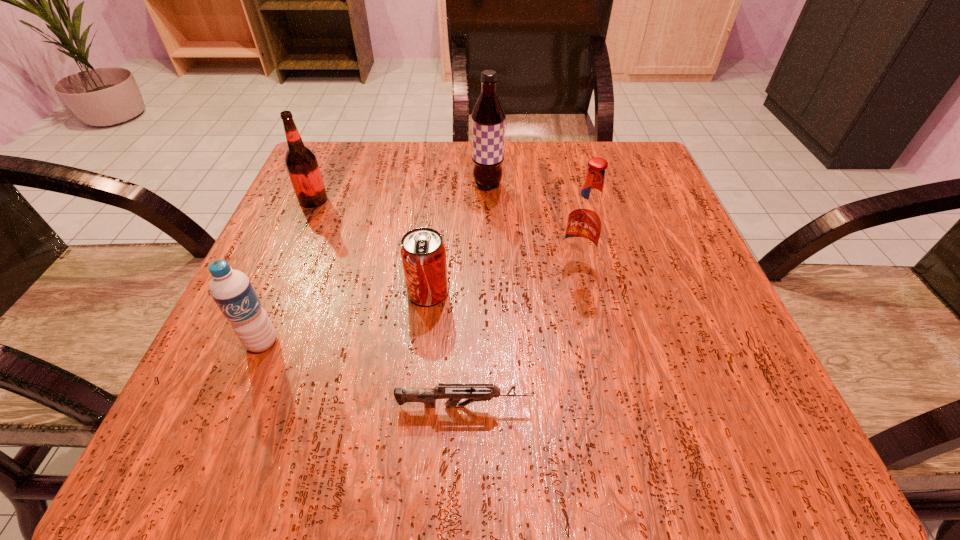
Where is `vacant region at the far edge`? This screenshot has width=960, height=540. vacant region at the far edge is located at coordinates (460, 168).

In the image, there is a desktop. At what (x,y) coordinates should I click in order to perform the action: click on free region at the near edge. Please return your answer as a coordinate pair (x, y). The height and width of the screenshot is (540, 960). Looking at the image, I should click on (575, 465).

Locate an element on the screen. This screenshot has height=540, width=960. vacant area at the left edge is located at coordinates (297, 252).

Locate an element on the screen. free region at the right edge of the desktop is located at coordinates (615, 225).

The width and height of the screenshot is (960, 540). In the image, there is a desktop. Identify the location of vacant space at the far left corner. (367, 195).

This screenshot has height=540, width=960. I want to click on vacant space at the far right corner, so click(660, 193).

In order to click on vacant point at the near right corner in this screenshot , I will do `click(683, 416)`.

Find the location of a particular element. free space between the fourth farthest object and the rightmost root beer is located at coordinates (502, 279).

The image size is (960, 540). I want to click on empty space between the second root beer from right to left and the nearest root beer, so click(x=532, y=225).

Locate an element on the screen. vacant point located between the nearest object and the second root beer from right to left is located at coordinates (476, 295).